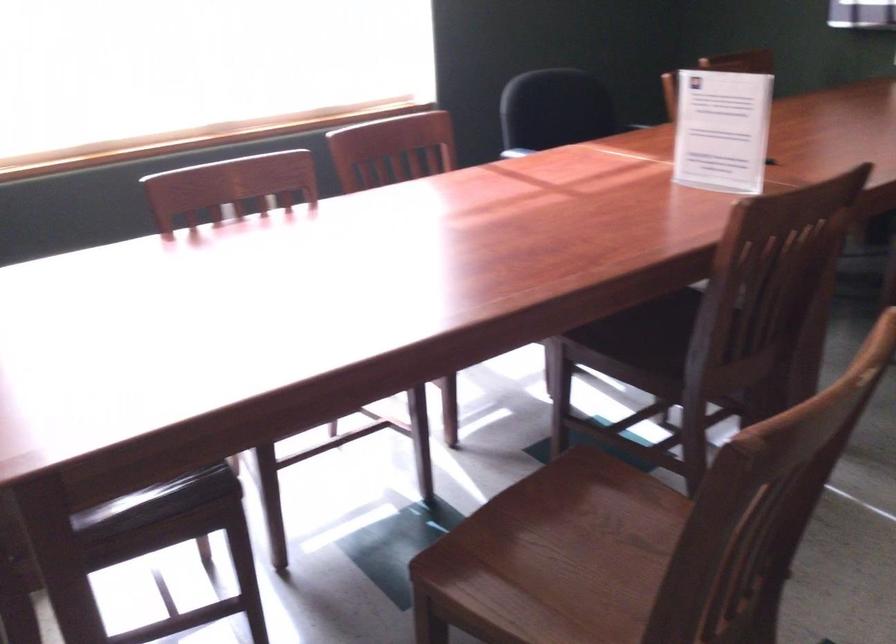
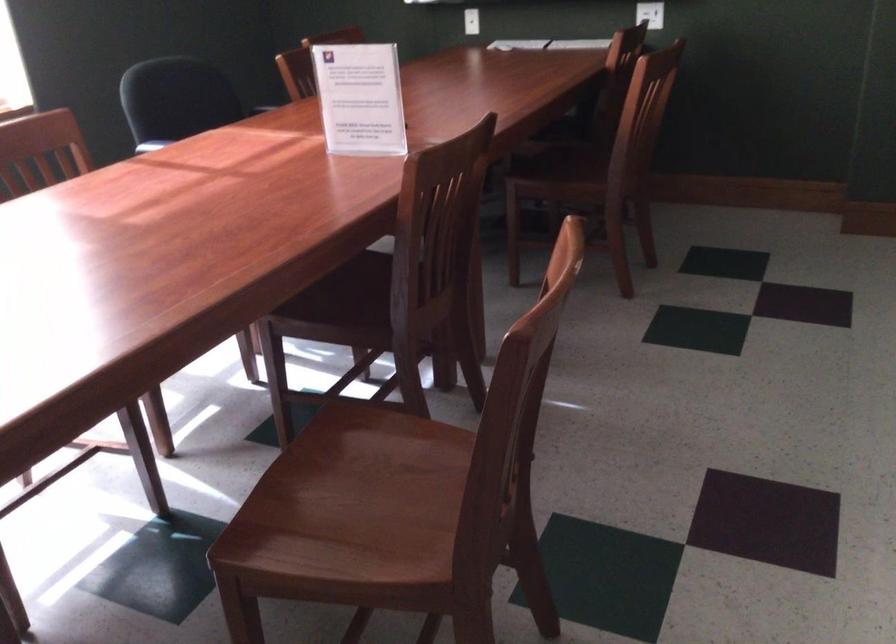
Where in the second image is the point corresponding to point (643, 339) from the first image?

(340, 301)